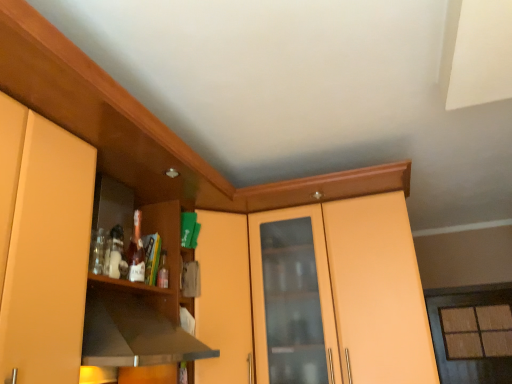
Describe the element at coordinates (42, 245) in the screenshot. I see `matte yellow cabinet at left` at that location.

In order to click on black matte exhaust hood at left in this screenshot , I will do `click(133, 333)`.

Is matte wood cabinet at center taller than black matte exhaust hood at left?

Yes.

How different are the orientations of matte wood cabinet at center and black matte exhaust hood at left in degrees?

The facing directions of matte wood cabinet at center and black matte exhaust hood at left are 1.4 degrees apart.

From a real-world perspective, which object stands above the other?

In real-world perspective, matte wood cabinet at center is above.

Choose the correct answer: Is matte wood cabinet at center inside black matte exhaust hood at left or outside it?

matte wood cabinet at center is spatially situated outside black matte exhaust hood at left.

Is matte yellow cabinet at left beside translucent glass bottle at shelf center?

No, matte yellow cabinet at left is not next to translucent glass bottle at shelf center.

Considering the sizes of matte yellow cabinet at left and translucent glass bottle at shelf center in the image, is matte yellow cabinet at left wider or thinner than translucent glass bottle at shelf center?

In the image, matte yellow cabinet at left appears to be wider than translucent glass bottle at shelf center.

In the image, is matte yellow cabinet at left on the left side or the right side of translucent glass bottle at shelf center?

Clearly, matte yellow cabinet at left is on the left of translucent glass bottle at shelf center in the image.

Can you tell me how much matte yellow cabinet at left and translucent glass bottle at shelf center differ in facing direction?

0.000181 degrees.

Is black matte exhaust hood at left oriented towards matte wood cabinet at center?

No, black matte exhaust hood at left is not turned towards matte wood cabinet at center.

Which of these two, black matte exhaust hood at left or matte wood cabinet at center, is bigger?

With larger size is matte wood cabinet at center.

Who is shorter, black matte exhaust hood at left or matte wood cabinet at center?

With less height is black matte exhaust hood at left.

Is black matte exhaust hood at left to the left of matte wood cabinet at center from the viewer's perspective?

Yes.

Is matte glass window at right facing away from translucent glass bottle at shelf center?

matte glass window at right does not have its back to translucent glass bottle at shelf center.

From a real-world perspective, which object stands above the other?

translucent glass bottle at shelf center.

Locate an element on the screen. This screenshot has width=512, height=384. window that is behind the translucent glass bottle at shelf center is located at coordinates (444, 341).

Are matte glass window at right and translucent glass bottle at shelf center far apart?

Indeed, matte glass window at right is not near translucent glass bottle at shelf center.

In the scene shown: Looking at the image, does black matte exhaust hood at left seem bigger or smaller compared to matte glass window at right?

Considering their sizes, black matte exhaust hood at left takes up less space than matte glass window at right.

Consider the image. Would you say black matte exhaust hood at left is inside or outside matte glass window at right?

black matte exhaust hood at left lies outside matte glass window at right.

From the image's perspective, is black matte exhaust hood at left located above matte glass window at right?

Correct, black matte exhaust hood at left appears higher than matte glass window at right in the image.

Considering the points (125, 307) and (463, 371), which point is behind, point (125, 307) or point (463, 371)?

Point (463, 371)

Find the location of a particular element. dresser lying in front of the translucent glass bottle at shelf center is located at coordinates (323, 290).

Is translucent glass bottle at shelf center aimed at matte wood cabinet at center?

No, translucent glass bottle at shelf center is not facing towards matte wood cabinet at center.

Considering the positions of objects translucent glass bottle at shelf center and matte wood cabinet at center in the image provided, who is in front, translucent glass bottle at shelf center or matte wood cabinet at center?

Positioned in front is matte wood cabinet at center.

Where is `window beneath the translucent glass bottle at shelf center (from a real-world perspective)`? The height and width of the screenshot is (384, 512). window beneath the translucent glass bottle at shelf center (from a real-world perspective) is located at coordinates (444, 341).

From a real-world perspective, is translucent glass bottle at shelf center positioned above or below matte glass window at right?

translucent glass bottle at shelf center is situated higher than matte glass window at right in the real world.

Between translucent glass bottle at shelf center and matte glass window at right, which one has less height?

translucent glass bottle at shelf center.

The height and width of the screenshot is (384, 512). In the image, there is a black matte exhaust hood at left. In order to click on dresser below it (from the image's perspective) in this screenshot , I will do `click(323, 290)`.

The image size is (512, 384). I want to click on cabinetry below the translucent glass bottle at shelf center (from a real-world perspective), so click(42, 245).

When comparing their distances from translucent glass bottle at shelf center, does matte wood cabinet at center or matte glass window at right seem closer?

Among the two, matte wood cabinet at center is located nearer to translucent glass bottle at shelf center.

Considering their positions, is matte wood cabinet at center positioned further to translucent glass bottle at shelf center than matte yellow cabinet at left?

matte yellow cabinet at left is positioned further to the anchor translucent glass bottle at shelf center.

Which object lies further to the anchor point matte wood cabinet at center, matte glass window at right or black matte exhaust hood at left?

matte glass window at right is positioned further to the anchor matte wood cabinet at center.

Considering their positions, is matte yellow cabinet at left positioned further to black matte exhaust hood at left than matte wood cabinet at center?

matte wood cabinet at center is positioned further to the anchor black matte exhaust hood at left.

Looking at the image, which one is located further to translucent glass bottle at shelf center, matte yellow cabinet at left or matte wood cabinet at center?

matte yellow cabinet at left is further to translucent glass bottle at shelf center.

Considering their positions, is black matte exhaust hood at left positioned further to matte wood cabinet at center than translucent glass bottle at shelf center?

Based on the image, translucent glass bottle at shelf center appears to be further to matte wood cabinet at center.

From the image, which object appears to be farther from matte yellow cabinet at left, matte glass window at right or matte wood cabinet at center?

matte glass window at right is positioned further to the anchor matte yellow cabinet at left.

Based on their spatial positions, is black matte exhaust hood at left or matte glass window at right further from matte yellow cabinet at left?

matte glass window at right is positioned further to the anchor matte yellow cabinet at left.

This screenshot has height=384, width=512. I want to click on dresser between black matte exhaust hood at left and matte glass window at right from left to right, so click(323, 290).

Find the location of a particular element. bottle between black matte exhaust hood at left and matte glass window at right in the horizontal direction is located at coordinates [163, 271].

This screenshot has width=512, height=384. I want to click on exhaust hood located between matte yellow cabinet at left and matte glass window at right in the left-right direction, so click(x=133, y=333).

At what (x,y) coordinates should I click in order to perform the action: click on dresser between matte yellow cabinet at left and matte glass window at right. Please return your answer as a coordinate pair (x, y). This screenshot has height=384, width=512. Looking at the image, I should click on (323, 290).